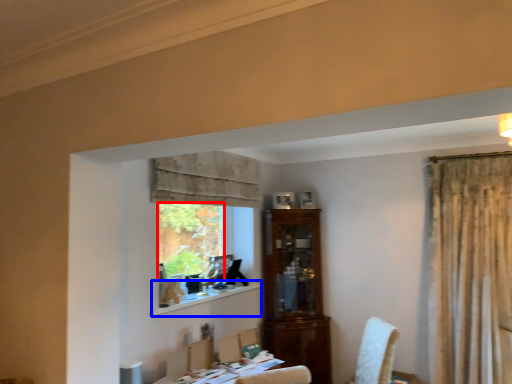
Question: Among these objects, which one is nearest to the camera, window screen (highlighted by a red box) or window sill (highlighted by a blue box)?

Choices:
 (A) window screen
 (B) window sill

Answer: (B)